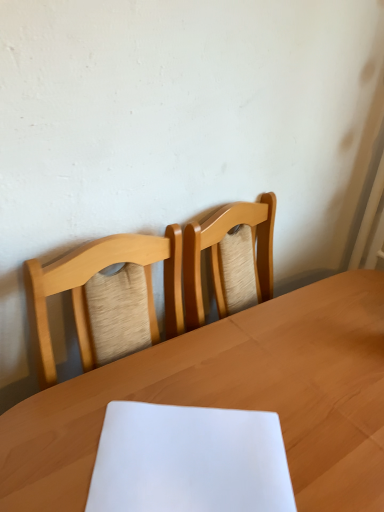
Question: In terms of width, does light wood table at center look wider or thinner when compared to white paper at center?

Choices:
 (A) wide
 (B) thin

Answer: (A)

Question: From a real-world perspective, is light wood table at center physically located above or below white paper at center?

Choices:
 (A) below
 (B) above

Answer: (A)

Question: Considering their positions, is light wood table at center located in front of or behind white paper at center?

Choices:
 (A) front
 (B) behind

Answer: (A)

Question: Is point (135, 458) positioned closer to the camera than point (322, 462)?

Choices:
 (A) farther
 (B) closer

Answer: (B)

Question: Based on their positions, is white paper at center located to the left or right of light wood table at center?

Choices:
 (A) left
 (B) right

Answer: (A)

Question: From a real-world perspective, is white paper at center physically located above or below light wood table at center?

Choices:
 (A) below
 (B) above

Answer: (B)

Question: Relative to light wood table at center, is white paper at center in front or behind?

Choices:
 (A) front
 (B) behind

Answer: (B)